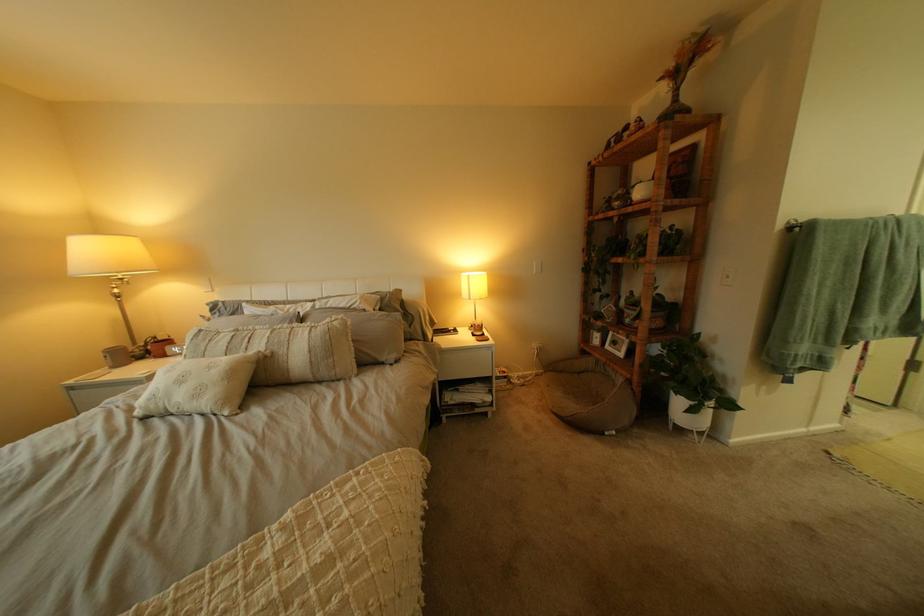
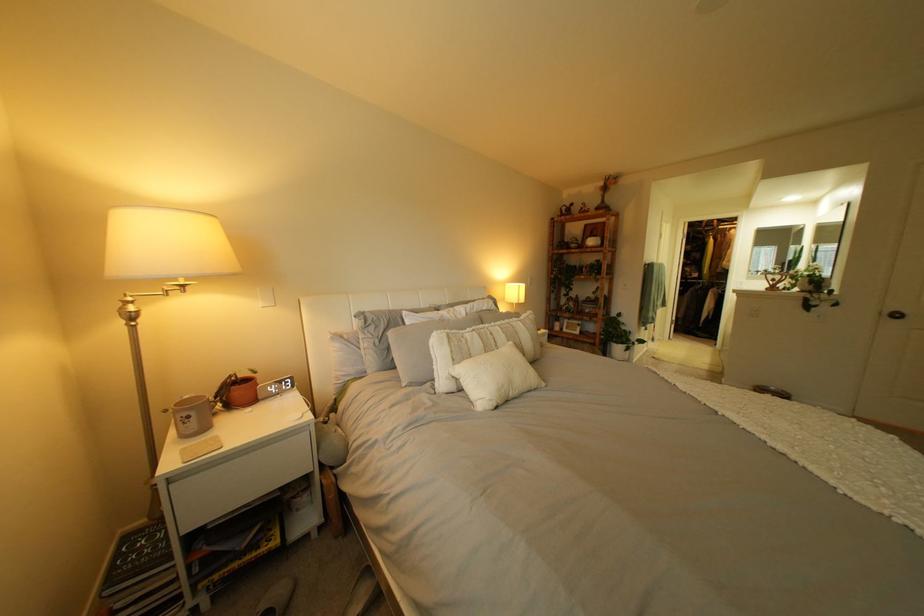
Where in the second image is the point corresponding to [281,342] from the first image?

(518, 337)